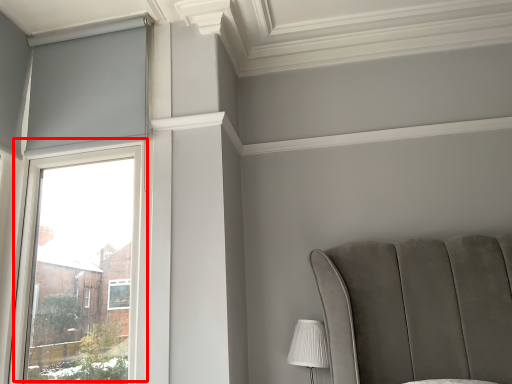
Question: From the image's perspective, what is the correct spatial positioning of window (annotated by the red box) in reference to table lamp?

Choices:
 (A) above
 (B) below

Answer: (A)